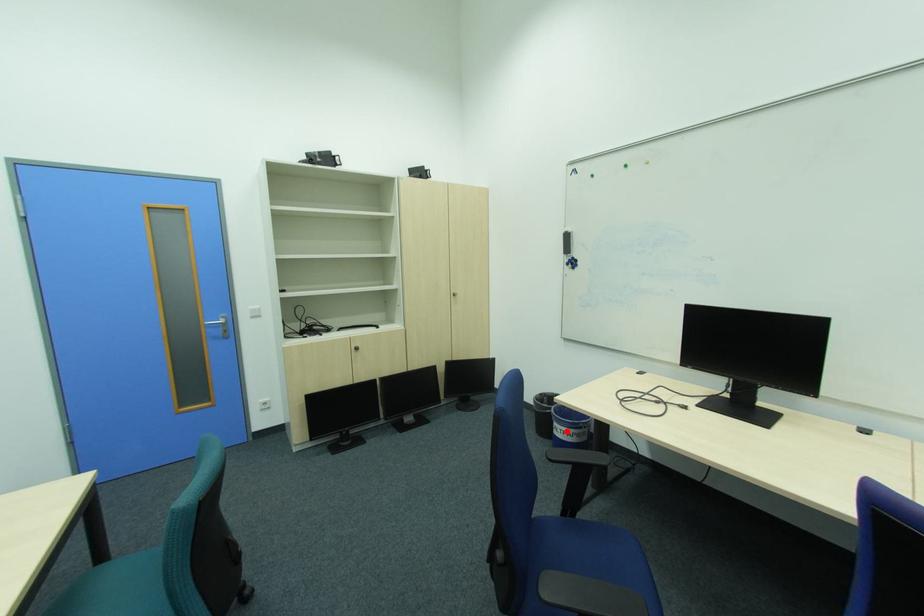
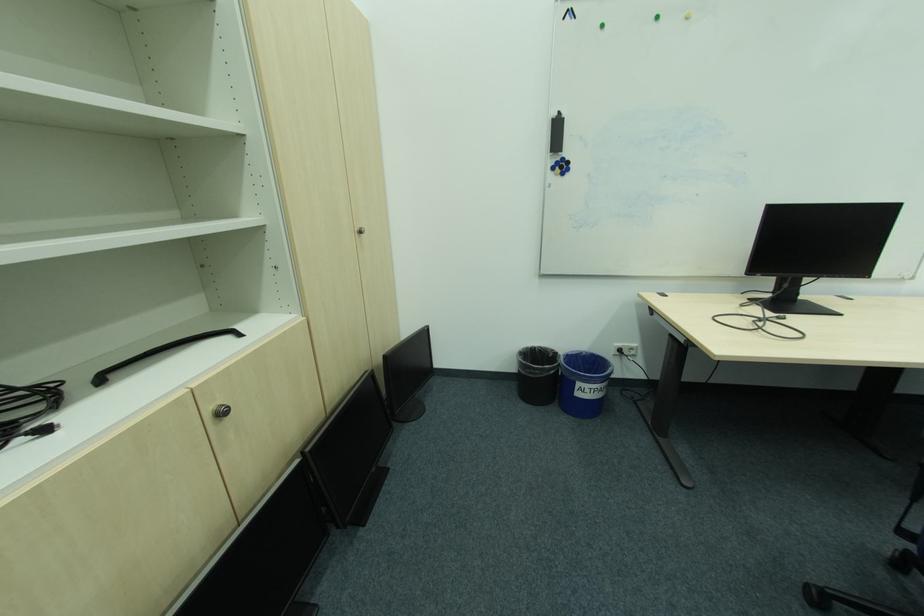
Find the pixel in the second image that matches the highlighted location in the first image.

(593, 391)